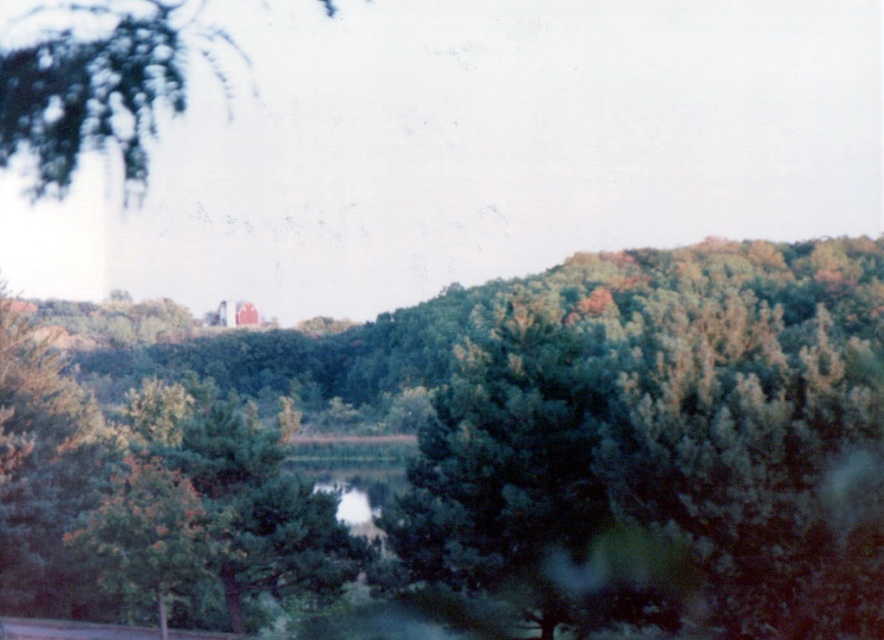
Based on the scene description, which object takes up more area in the image between the green leafy forest at center and the green leafy tree at upper left?

The green leafy tree at upper left takes up more area than the green leafy forest at center in the image.

You are standing in the serene landscape and want to know the relative positions of the green leafy forest at center and the green leafy tree at upper left. Which one is positioned lower in the image?

The green leafy forest at center is positioned lower than the green leafy tree at upper left because it is located below it.